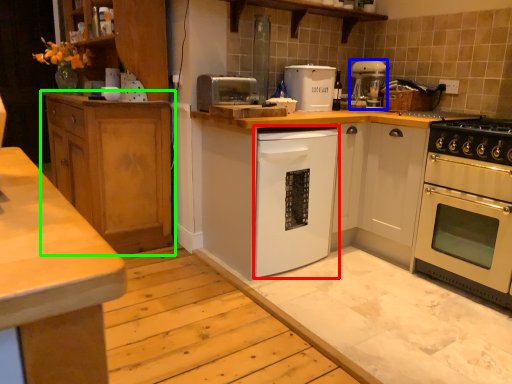
Question: Which is nearer to the dish washer (highlighted by a red box)? coffee machine (highlighted by a blue box) or cabinetry (highlighted by a green box).

Choices:
 (A) coffee machine
 (B) cabinetry

Answer: (B)